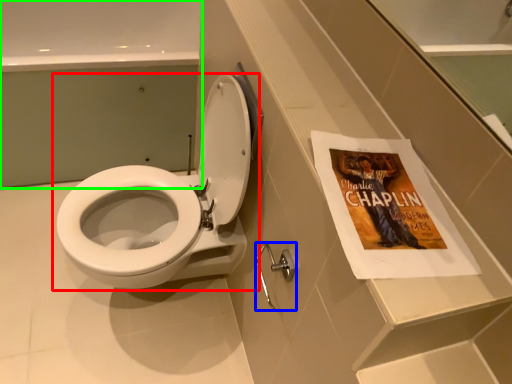
Question: Which object is the closest to the toilet (highlighted by a red box)? Choose among these: towel bar (highlighted by a blue box) or bath (highlighted by a green box).

Choices:
 (A) towel bar
 (B) bath

Answer: (A)